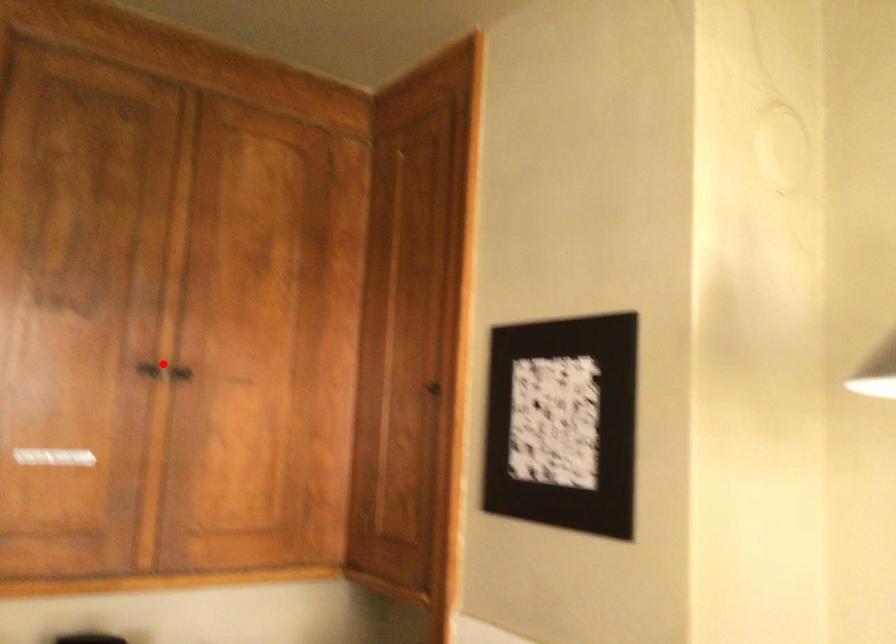
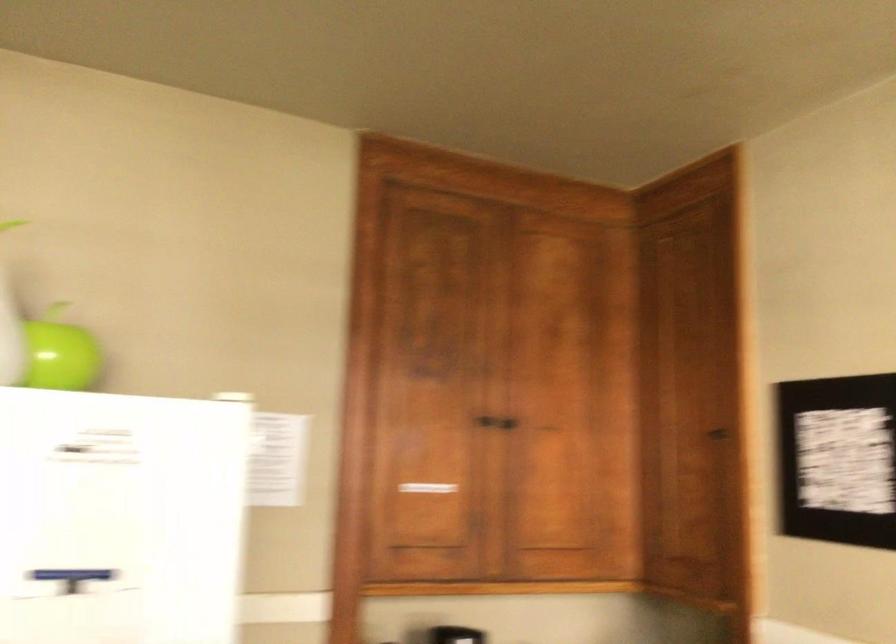
Question: I am providing you with two images of the same scene from different viewpoints. Given a red point in image1, look at the same physical point in image2. Is it:

Choices:
 (A) Closer to the viewpoint
 (B) Farther from the viewpoint

Answer: (B)